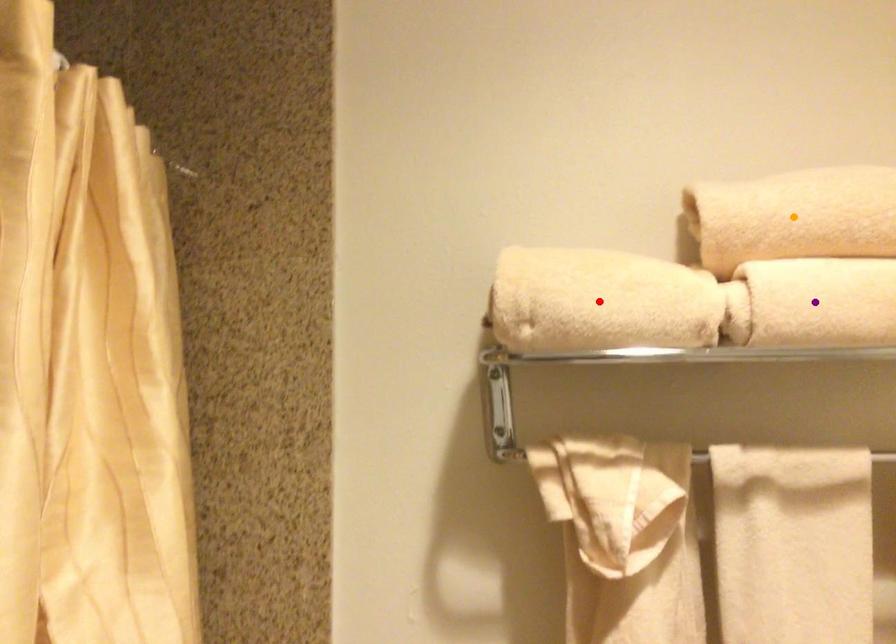
Order these from farthest to nearest:
- purple point
- orange point
- red point

1. orange point
2. red point
3. purple point